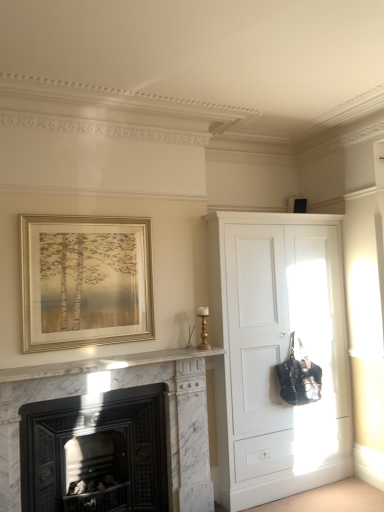
At what (x,y) coordinates should I click in order to perform the action: click on marble fireplace at lower left. Please return your answer as a coordinate pair (x, y). Looking at the image, I should click on (118, 388).

Describe the element at coordinates (85, 281) in the screenshot. I see `gold metallic frame at upper left` at that location.

You are a GUI agent. You are given a task and a screenshot of the screen. Output one action in this format:
    pyautogui.click(x=<x>, y=<y>)
    Task: Click on the marble fireplace at lower left
    The image size is (384, 512).
    Given the screenshot: What is the action you would take?
    pyautogui.click(x=118, y=388)

From the image's perspective, which object appears higher, gold metallic frame at upper left or white matte cupboard at right?

gold metallic frame at upper left, from the image's perspective.

Consider the image. Could you tell me if gold metallic frame at upper left is turned towards white matte cupboard at right?

No, gold metallic frame at upper left is not facing towards white matte cupboard at right.

Is marble fireplace at lower left next to white matte cupboard at right?

No, marble fireplace at lower left is not making contact with white matte cupboard at right.

Based on their positions, is marble fireplace at lower left located to the left or right of white matte cupboard at right?

marble fireplace at lower left is to the left of white matte cupboard at right.

Is marble fireplace at lower left in front of or behind white matte cupboard at right in the image?

Clearly, marble fireplace at lower left is in front of white matte cupboard at right.

How different are the orientations of marble fireplace at lower left and white matte cupboard at right in degrees?

There is a 0.683-degree angle between the facing directions of marble fireplace at lower left and white matte cupboard at right.

Who is smaller, gold metallic frame at upper left or marble fireplace at lower left?

With smaller size is gold metallic frame at upper left.

Is gold metallic frame at upper left looking in the opposite direction of marble fireplace at lower left?

No, gold metallic frame at upper left is not facing away from marble fireplace at lower left.

Considering the relative sizes of gold metallic frame at upper left and marble fireplace at lower left in the image provided, is gold metallic frame at upper left shorter than marble fireplace at lower left?

Yes, gold metallic frame at upper left is shorter than marble fireplace at lower left.

Which is more to the left, gold metallic frame at upper left or marble fireplace at lower left?

gold metallic frame at upper left is more to the left.

Can you confirm if white matte cupboard at right is shorter than marble fireplace at lower left?

No.

Is white matte cupboard at right oriented away from marble fireplace at lower left?

No.

Does point (270, 406) come behind point (183, 390)?

Yes.

Which is less distant, (x=18, y=378) or (x=146, y=226)?

Point (x=18, y=378)

Does marble fireplace at lower left have a greater width compared to gold metallic frame at upper left?

Yes, marble fireplace at lower left is wider than gold metallic frame at upper left.

Locate an element on the screen. The height and width of the screenshot is (512, 384). fireplace that appears below the gold metallic frame at upper left (from the image's perspective) is located at coordinates (118, 388).

What are the coordinates of `cupboard below the gold metallic frame at upper left (from a real-world perspective)` in the screenshot? It's located at (277, 353).

Can we say white matte cupboard at right lies outside gold metallic frame at upper left?

Yes, white matte cupboard at right is outside of gold metallic frame at upper left.

Considering the sizes of objects white matte cupboard at right and gold metallic frame at upper left in the image provided, who is shorter, white matte cupboard at right or gold metallic frame at upper left?

gold metallic frame at upper left.

Identify the location of cupboard to the right of gold metallic frame at upper left. (277, 353).

Find the location of a particular element. cupboard positioned vertically above the marble fireplace at lower left (from a real-world perspective) is located at coordinates (277, 353).

Which object lies further to the anchor point white matte cupboard at right, marble fireplace at lower left or gold metallic frame at upper left?

gold metallic frame at upper left lies further to white matte cupboard at right than the other object.

From the picture: Which object lies further to the anchor point white matte cupboard at right, gold metallic frame at upper left or marble fireplace at lower left?

gold metallic frame at upper left lies further to white matte cupboard at right than the other object.

When comparing their distances from marble fireplace at lower left, does white matte cupboard at right or gold metallic frame at upper left seem further?

The object further to marble fireplace at lower left is white matte cupboard at right.

From the image, which object appears to be farther from gold metallic frame at upper left, white matte cupboard at right or marble fireplace at lower left?

white matte cupboard at right.

Based on their spatial positions, is gold metallic frame at upper left or white matte cupboard at right closer to marble fireplace at lower left?

gold metallic frame at upper left lies closer to marble fireplace at lower left than the other object.

From the image, which object appears to be nearer to gold metallic frame at upper left, marble fireplace at lower left or white matte cupboard at right?

Based on the image, marble fireplace at lower left appears to be nearer to gold metallic frame at upper left.

Image resolution: width=384 pixels, height=512 pixels. I want to click on fireplace situated between gold metallic frame at upper left and white matte cupboard at right from left to right, so click(x=118, y=388).